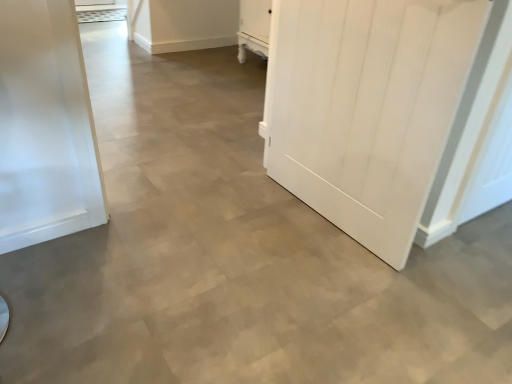
What do you see at coordinates (366, 107) in the screenshot? I see `white wood door at right` at bounding box center [366, 107].

The height and width of the screenshot is (384, 512). What are the coordinates of `white wood door at right` in the screenshot? It's located at (366, 107).

Image resolution: width=512 pixels, height=384 pixels. I want to click on white wood door at right, so click(366, 107).